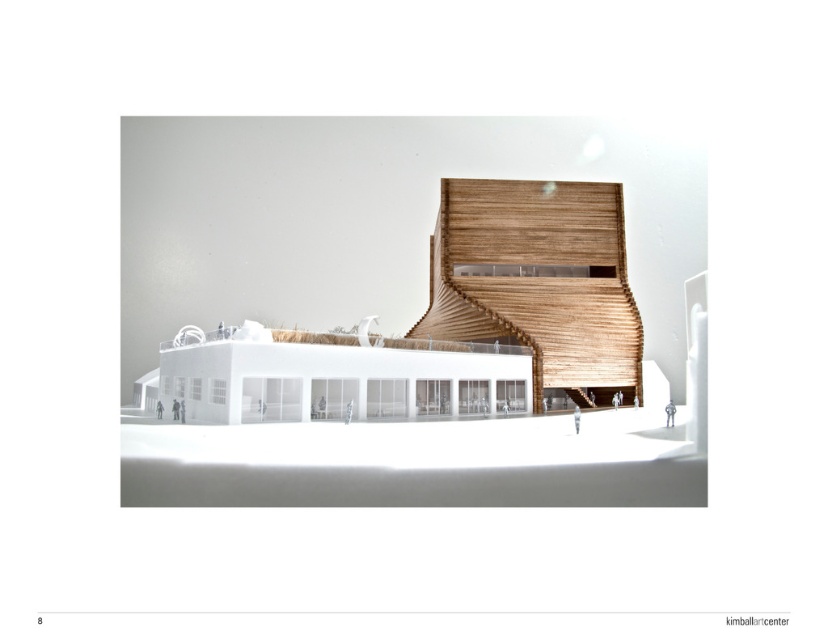
Is wooden staircase at center closer to camera compared to wooden slats at center?

Yes, it is.

Where is `wooden staircase at center`? This screenshot has width=828, height=640. wooden staircase at center is located at coordinates (445, 324).

Between point (350, 372) and point (532, 275), which one is positioned behind?

Positioned behind is point (532, 275).

Find the location of a particular element. Image resolution: width=828 pixels, height=640 pixels. wooden staircase at center is located at coordinates (445, 324).